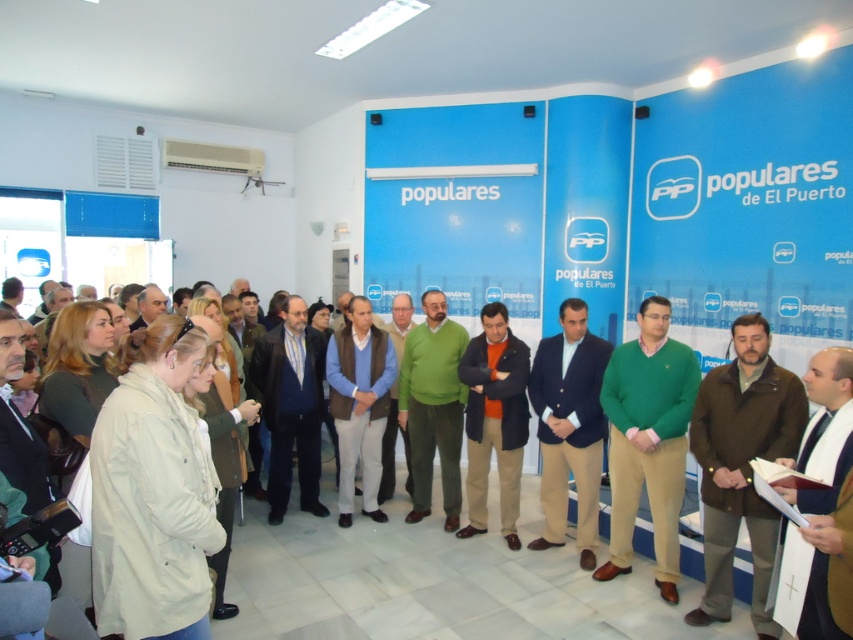
Question: Which of the following is the farthest from the observer?

Choices:
 (A) (164, 300)
 (B) (503, 531)
 (C) (587, 552)
 (D) (804, 602)

Answer: (A)

Question: Does navy blue suit at center lie behind matte black jacket at center?

Choices:
 (A) no
 (B) yes

Answer: (A)

Question: Can you confirm if navy blue suit at center is bigger than orange fleece at center?

Choices:
 (A) yes
 (B) no

Answer: (B)

Question: Which object appears closest to the camera in this image?

Choices:
 (A) green matte sweater at center
 (B) light blue sweater at center

Answer: (A)

Question: From the image, what is the correct spatial relationship of dark gray suit at center in relation to matte black jacket at center?

Choices:
 (A) below
 (B) above

Answer: (A)

Question: Which point is closer to the camera taking this photo?

Choices:
 (A) (389, 412)
 (B) (467, 500)
 (C) (345, 342)
 (D) (141, 305)

Answer: (B)